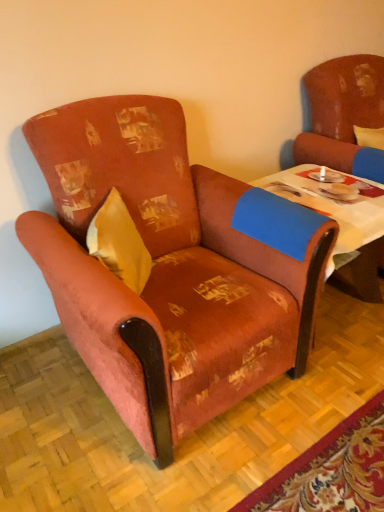
Identify the location of blank space situated above blue fabric table at center (from a real-world perspective). The height and width of the screenshot is (512, 384). (309, 184).